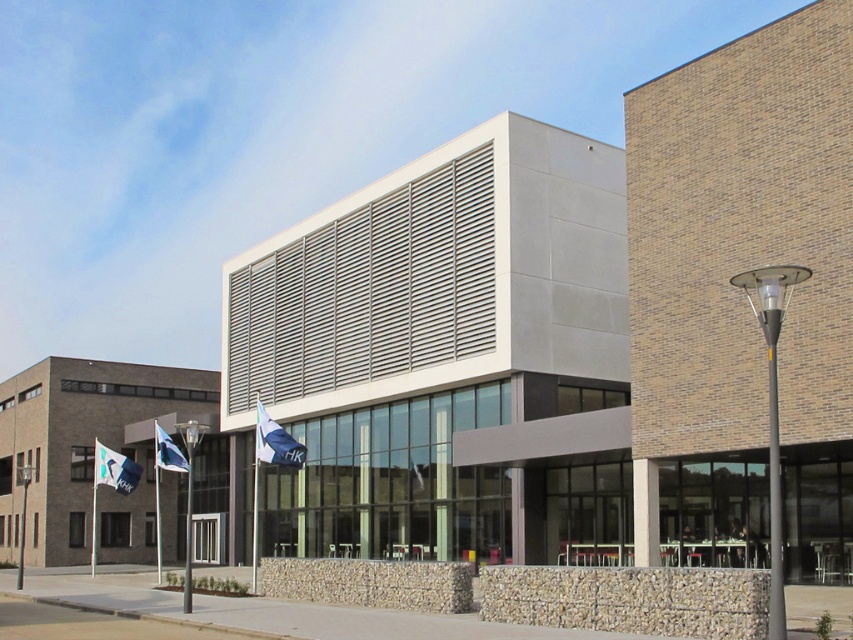
Question: Based on their relative distances, which object is farther from the black metal lamp post at center?

Choices:
 (A) black metal pole at right
 (B) white fabric flag at lower left

Answer: (A)

Question: Is black metal lamp post at center behind metallic gray pole at left?

Choices:
 (A) no
 (B) yes

Answer: (A)

Question: Is blue fabric flag at center thinner than metallic gray pole at left?

Choices:
 (A) yes
 (B) no

Answer: (A)

Question: Does black metal pole at right appear over black metal lamp post at center?

Choices:
 (A) yes
 (B) no

Answer: (A)

Question: Which is nearer to the black metal lamp post at center?

Choices:
 (A) black metal pole at right
 (B) blue fabric flag at center
 (C) white fabric flag at center

Answer: (C)

Question: Estimate the real-world distances between objects in this image. Which object is farther from the metallic gray pole at left?

Choices:
 (A) black metal lamp post at center
 (B) white fabric flag at center
 (C) white fabric flag at lower left

Answer: (A)